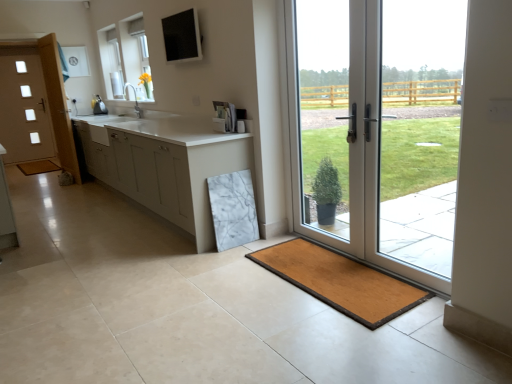
Where is `matte black screen at upper center`? The image size is (512, 384). matte black screen at upper center is located at coordinates (182, 36).

Where is `white glass door at left, which is the second door in front-to-back order`? white glass door at left, which is the second door in front-to-back order is located at coordinates (24, 109).

Find the location of `brown rubber bath mat at lower right, the 2th bath mat positioned from the top`. brown rubber bath mat at lower right, the 2th bath mat positioned from the top is located at coordinates (340, 281).

How many degrees apart are the facing directions of white glass door at left, which is the second door in front-to-back order, and brown rubber bath mat at lower right, which is the 1th bath mat in right-to-left order?

90.1 degrees.

Could you measure the distance between white glass door at left, arranged as the 1th door when viewed from the back, and brown rubber bath mat at lower right, which is the 1th bath mat in right-to-left order?

The distance of white glass door at left, arranged as the 1th door when viewed from the back, from brown rubber bath mat at lower right, which is the 1th bath mat in right-to-left order, is 5.37 meters.

Is white glass door at left, which is the second door from right to left, smaller than brown rubber bath mat at lower right, the 2th bath mat positioned from the top?

Actually, white glass door at left, which is the second door from right to left, might be larger than brown rubber bath mat at lower right, the 2th bath mat positioned from the top.

Relative to brown rubber bath mat at lower right, which is the 1th bath mat in right-to-left order, is white glass door at left, arranged as the 1th door when viewed from the back, in front or behind?

Clearly, white glass door at left, arranged as the 1th door when viewed from the back, is behind brown rubber bath mat at lower right, which is the 1th bath mat in right-to-left order.

How different are the orientations of brown wooden bath mat at lower left, placed as the second bath mat when sorted from front to back, and matte black screen at upper center in degrees?

There is a 91.4-degree angle between the facing directions of brown wooden bath mat at lower left, placed as the second bath mat when sorted from front to back, and matte black screen at upper center.

Is matte black screen at upper center surrounded by brown wooden bath mat at lower left, the 1th bath mat when ordered from back to front?

No.

Between brown wooden bath mat at lower left, placed as the second bath mat when sorted from front to back, and matte black screen at upper center, which one has smaller size?

matte black screen at upper center is smaller.

Considering the positions of points (24, 164) and (168, 31), is point (24, 164) closer to camera compared to point (168, 31)?

That is False.

Looking at this image, which is more to the right, white matte cabinet at center or brown rubber bath mat at lower right, arranged as the 2th bath mat when viewed from the left?

brown rubber bath mat at lower right, arranged as the 2th bath mat when viewed from the left.

Is white matte cabinet at center aimed at brown rubber bath mat at lower right, the 2th bath mat positioned from the top?

No, white matte cabinet at center is not turned towards brown rubber bath mat at lower right, the 2th bath mat positioned from the top.

Between white matte cabinet at center and brown rubber bath mat at lower right, arranged as the 2th bath mat when viewed from the left, which one has larger width?

white matte cabinet at center.

How many degrees apart are the facing directions of matte black screen at upper center and white glossy door at right, the first door when ordered from right to left?

The angle between the facing direction of matte black screen at upper center and the facing direction of white glossy door at right, the first door when ordered from right to left, is 1.75 degrees.

Is matte black screen at upper center to the right of white glossy door at right, the first door when ordered from right to left, from the viewer's perspective?

Incorrect, matte black screen at upper center is not on the right side of white glossy door at right, the first door when ordered from right to left.

In the scene shown: Is matte black screen at upper center surrounding white glossy door at right, positioned as the first door in front-to-back order?

That's incorrect, white glossy door at right, positioned as the first door in front-to-back order, is not inside matte black screen at upper center.

Is matte black screen at upper center with white glossy door at right, acting as the 2th door starting from the back?

matte black screen at upper center is not next to white glossy door at right, acting as the 2th door starting from the back, and they're not touching.

Is brown rubber bath mat at lower right, arranged as the 2th bath mat when viewed from the left, to the left of white matte cabinet at center from the viewer's perspective?

Incorrect, brown rubber bath mat at lower right, arranged as the 2th bath mat when viewed from the left, is not on the left side of white matte cabinet at center.

Considering the relative sizes of brown rubber bath mat at lower right, placed as the first bath mat when sorted from bottom to top, and white matte cabinet at center in the image provided, is brown rubber bath mat at lower right, placed as the first bath mat when sorted from bottom to top, bigger than white matte cabinet at center?

No, brown rubber bath mat at lower right, placed as the first bath mat when sorted from bottom to top, is not bigger than white matte cabinet at center.

Is white matte cabinet at center completely or partially inside brown rubber bath mat at lower right, the 2th bath mat positioned from the top?

No, white matte cabinet at center is not surrounded by brown rubber bath mat at lower right, the 2th bath mat positioned from the top.

How different are the orientations of brown rubber bath mat at lower right, the 1th bath mat when ordered from front to back, and white matte cabinet at center in degrees?

There is a 0.448-degree angle between the facing directions of brown rubber bath mat at lower right, the 1th bath mat when ordered from front to back, and white matte cabinet at center.

Is matte black screen at upper center outside of brown wooden bath mat at lower left, the 1th bath mat when ordered from back to front?

matte black screen at upper center is positioned outside brown wooden bath mat at lower left, the 1th bath mat when ordered from back to front.

Is point (184, 31) closer or farther from the camera than point (51, 162)?

Point (184, 31) appears to be closer to the viewer than point (51, 162).

Considering the sizes of objects matte black screen at upper center and brown wooden bath mat at lower left, the 2th bath mat positioned from the bottom, in the image provided, who is bigger, matte black screen at upper center or brown wooden bath mat at lower left, the 2th bath mat positioned from the bottom,?

brown wooden bath mat at lower left, the 2th bath mat positioned from the bottom, is bigger.

Can you confirm if matte black screen at upper center is shorter than brown wooden bath mat at lower left, the 2th bath mat positioned from the bottom?

No.

Between white glass door at left, which is the second door from right to left, and matte black screen at upper center, which one appears on the right side from the viewer's perspective?

From the viewer's perspective, matte black screen at upper center appears more on the right side.

Is white glass door at left, arranged as the 1th door when viewed from the back, in front of or behind matte black screen at upper center in the image?

Clearly, white glass door at left, arranged as the 1th door when viewed from the back, is behind matte black screen at upper center.

Is white glass door at left, which is the second door from right to left, completely or partially outside of matte black screen at upper center?

Yes, white glass door at left, which is the second door from right to left, is not within matte black screen at upper center.

In the scene shown: Considering the sizes of objects white glass door at left, the 1th door in the left-to-right sequence, and matte black screen at upper center in the image provided, who is wider, white glass door at left, the 1th door in the left-to-right sequence, or matte black screen at upper center?

With larger width is white glass door at left, the 1th door in the left-to-right sequence.

What are the coordinates of `the 2nd bath mat directly beneath the white glass door at left, which is the second door in front-to-back order (from a real-world perspective)` in the screenshot? It's located at (340, 281).

The width and height of the screenshot is (512, 384). I want to click on window screen above the brown wooden bath mat at lower left, placed as the second bath mat when sorted from front to back (from the image's perspective), so click(x=182, y=36).

Looking at the image, which one is located closer to brown wooden bath mat at lower left, which appears as the 2th bath mat when viewed from the right, matte black screen at upper center or white matte cabinet at center?

Based on the image, white matte cabinet at center appears to be nearer to brown wooden bath mat at lower left, which appears as the 2th bath mat when viewed from the right.

Based on their spatial positions, is white matte cabinet at center or brown wooden bath mat at lower left, which appears as the 2th bath mat when viewed from the right, closer to brown rubber bath mat at lower right, the 2th bath mat from the back?

Based on the image, white matte cabinet at center appears to be nearer to brown rubber bath mat at lower right, the 2th bath mat from the back.

Estimate the real-world distances between objects in this image. Which object is closer to white glossy door at right, acting as the 2th door starting from the back, brown rubber bath mat at lower right, arranged as the 2th bath mat when viewed from the left, or white matte cabinet at center?

brown rubber bath mat at lower right, arranged as the 2th bath mat when viewed from the left, is positioned closer to the anchor white glossy door at right, acting as the 2th door starting from the back.

Considering their positions, is white glossy door at right, the 2th door from the left, positioned further to white glass door at left, the 1th door in the left-to-right sequence, than matte black screen at upper center?

white glossy door at right, the 2th door from the left, is positioned further to the anchor white glass door at left, the 1th door in the left-to-right sequence.

Based on their spatial positions, is white glossy door at right, positioned as the first door in front-to-back order, or brown wooden bath mat at lower left, placed as the second bath mat when sorted from front to back, closer to white matte cabinet at center?

white glossy door at right, positioned as the first door in front-to-back order, is closer to white matte cabinet at center.

Based on their spatial positions, is matte black screen at upper center or brown wooden bath mat at lower left, marked as the 1th bath mat in a left-to-right arrangement, further from white glass door at left, which is the second door in front-to-back order?

matte black screen at upper center.

Estimate the real-world distances between objects in this image. Which object is further from white matte cabinet at center, matte black screen at upper center or white glass door at left, which is the second door from right to left?

white glass door at left, which is the second door from right to left, is further to white matte cabinet at center.

Consider the image. Looking at the image, which one is located further to white glass door at left, which is the second door from right to left, brown wooden bath mat at lower left, marked as the 1th bath mat in a left-to-right arrangement, or white matte cabinet at center?

The object further to white glass door at left, which is the second door from right to left, is white matte cabinet at center.

The image size is (512, 384). Find the location of `bath mat located between white matte cabinet at center and white glossy door at right, positioned as the first door in front-to-back order, in the left-right direction`. bath mat located between white matte cabinet at center and white glossy door at right, positioned as the first door in front-to-back order, in the left-right direction is located at coordinates (340, 281).

The height and width of the screenshot is (384, 512). I want to click on window screen positioned between white glossy door at right, positioned as the first door in front-to-back order, and white glass door at left, the 1th door in the left-to-right sequence, from near to far, so click(x=182, y=36).

I want to click on bath mat positioned between matte black screen at upper center and white glass door at left, arranged as the 1th door when viewed from the back, from near to far, so click(x=38, y=167).

The height and width of the screenshot is (384, 512). Identify the location of window screen between white matte cabinet at center and white glass door at left, the 1th door in the left-to-right sequence, in the front-back direction. (182, 36).